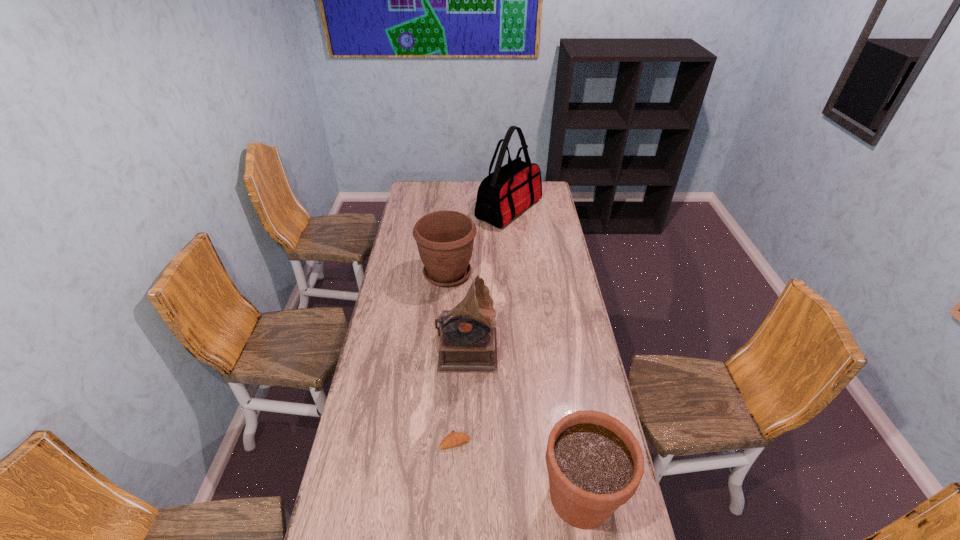
Where is `vacant point located between the duffel bag and the farther flowerpot`? The image size is (960, 540). vacant point located between the duffel bag and the farther flowerpot is located at coordinates (478, 242).

The height and width of the screenshot is (540, 960). What are the coordinates of `free space between the tallest object and the second tallest object` in the screenshot? It's located at (488, 277).

At what (x,y) coordinates should I click in order to perform the action: click on free space between the fourth nearest object and the duffel bag. Please return your answer as a coordinate pair (x, y). Image resolution: width=960 pixels, height=540 pixels. Looking at the image, I should click on coord(478,242).

Locate an element on the screen. Image resolution: width=960 pixels, height=540 pixels. the closest object to the right flowerpot is located at coordinates (453, 439).

Identify the location of object that stands as the third closest to the tallest object. (453, 439).

Where is `free spot that satisfies the following two spatial constraints: 1. from the horn of the second tallest object; 2. on the front side of the shortest object`? The image size is (960, 540). free spot that satisfies the following two spatial constraints: 1. from the horn of the second tallest object; 2. on the front side of the shortest object is located at coordinates (465, 441).

The height and width of the screenshot is (540, 960). I want to click on free region that satisfies the following two spatial constraints: 1. on the front side of the farther flowerpot; 2. on the left side of the crescent roll, so pyautogui.click(x=433, y=441).

What are the coordinates of `vacant space that satisfies the following two spatial constraints: 1. on the front side of the second nearest object; 2. on the left side of the fourth nearest object` in the screenshot? It's located at (433, 441).